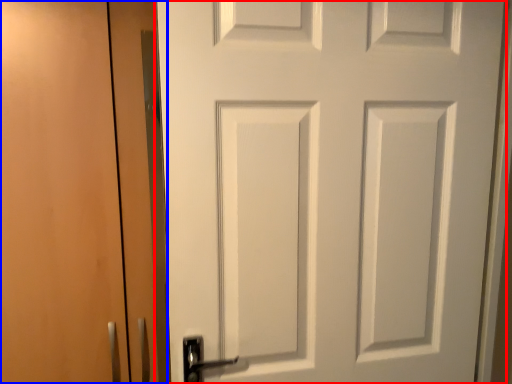
Question: Which point is closer to the camera, door (highlighted by a red box) or garage door (highlighted by a blue box)?

Choices:
 (A) door
 (B) garage door

Answer: (A)